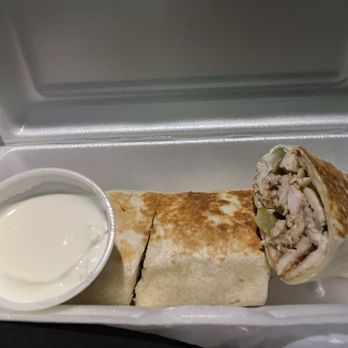
Find the location of a particular element. This screenshot has width=348, height=348. box is located at coordinates (183, 162).